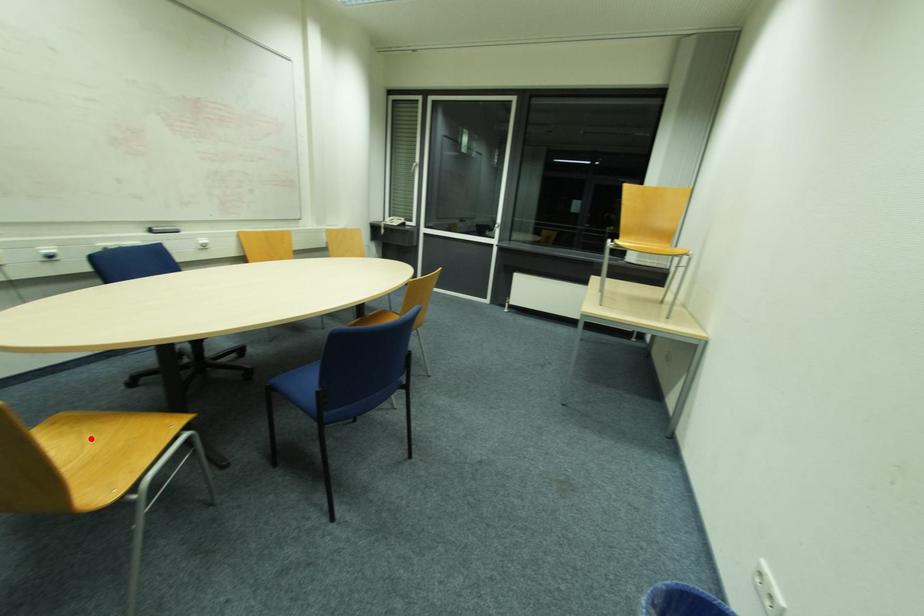
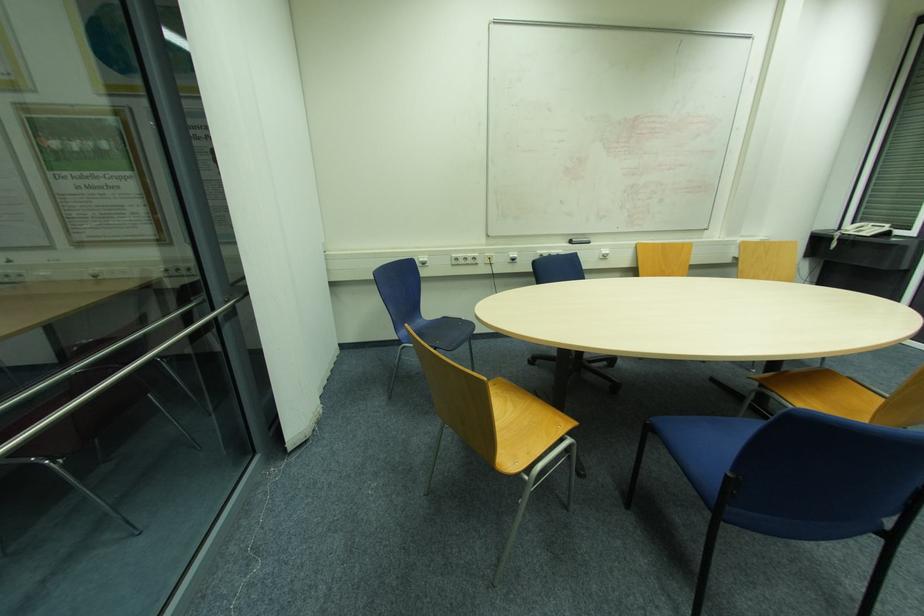
The point at the highlighted location is marked in the first image. Where is the corresponding point in the second image?

(511, 407)